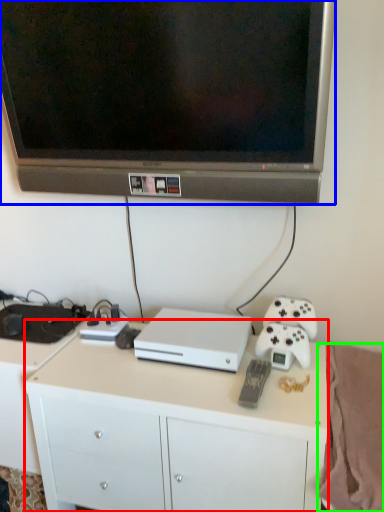
Question: Which is farther away from desk (highlighted by a red box)? television (highlighted by a blue box) or blanket (highlighted by a green box)?

Choices:
 (A) television
 (B) blanket

Answer: (A)